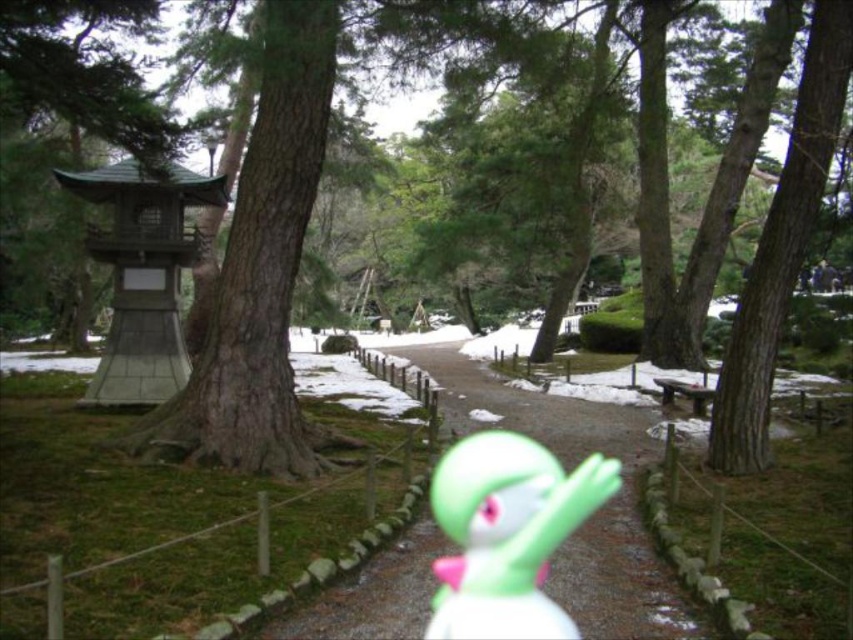
Is the position of green matte tree at center more distant than that of green rubber toy at center?

No, green matte tree at center is closer to the viewer.

Image resolution: width=853 pixels, height=640 pixels. I want to click on green matte tree at center, so click(x=258, y=268).

Locate an element on the screen. Image resolution: width=853 pixels, height=640 pixels. smooth concrete path at center is located at coordinates (593, 515).

Which is more to the right, smooth concrete path at center or green rubber toy at center?

Positioned to the right is smooth concrete path at center.

Between point (515, 428) and point (543, 458), which one is positioned in front?

Point (543, 458) is in front.

Identify the location of smooth concrete path at center. The width and height of the screenshot is (853, 640). (593, 515).

Can you confirm if green matte tree at center is positioned below smooth concrete path at center?

Actually, green matte tree at center is above smooth concrete path at center.

Is green matte tree at center above smooth concrete path at center?

Yes, green matte tree at center is above smooth concrete path at center.

At what (x,y) coordinates should I click in order to perform the action: click on green matte tree at center. Please return your answer as a coordinate pair (x, y). Looking at the image, I should click on (258, 268).